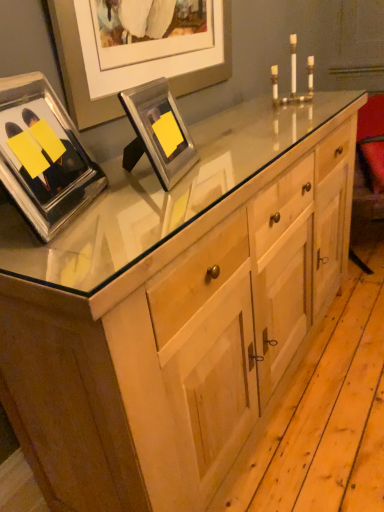
You are a GUI agent. You are given a task and a screenshot of the screen. Output one action in this format:
    pyautogui.click(x=<x>, y=<y>)
    Task: Click on the metallic silver picture frame at upper center, arranged as the 1th picture frame when viewed from the right
    The width and height of the screenshot is (384, 512).
    Given the screenshot: What is the action you would take?
    [158, 132]

Image resolution: width=384 pixels, height=512 pixels. Describe the element at coordinates (292, 79) in the screenshot. I see `gold metallic candle holder at upper center` at that location.

Image resolution: width=384 pixels, height=512 pixels. In order to click on clear glass picture frame at upper left, which is the 1th picture frame from left to right in this screenshot , I will do `click(43, 155)`.

You are a GUI agent. You are given a task and a screenshot of the screen. Output one action in this format:
    pyautogui.click(x=<x>, y=<y>)
    Task: Click on the metallic silver picture frame at upper center, arranged as the 1th picture frame when viewed from the right
    The height and width of the screenshot is (512, 384).
    Given the screenshot: What is the action you would take?
    pyautogui.click(x=158, y=132)

Can you confirm if clear glass picture frame at upper left, which is the second picture frame in right-to-left order, is shorter than gold metallic candle holder at upper center?

No.

From the picture: Which point is more distant from viewer, (17,157) or (281,104)?

The point (281,104) is farther from the camera.

Does clear glass picture frame at upper left, which is the second picture frame in right-to-left order, have a larger size compared to gold metallic candle holder at upper center?

Indeed, clear glass picture frame at upper left, which is the second picture frame in right-to-left order, has a larger size compared to gold metallic candle holder at upper center.

Is clear glass picture frame at upper left, which is the 1th picture frame from left to right, oriented towards metallic silver picture frame at upper center, arranged as the 1th picture frame when viewed from the right?

Yes.

How many degrees apart are the facing directions of clear glass picture frame at upper left, which is the second picture frame in right-to-left order, and metallic silver picture frame at upper center, arranged as the 1th picture frame when viewed from the right?

The angular difference between clear glass picture frame at upper left, which is the second picture frame in right-to-left order, and metallic silver picture frame at upper center, arranged as the 1th picture frame when viewed from the right, is 9.28 degrees.

Is point (38, 184) closer or farther from the camera than point (148, 110)?

Point (38, 184) appears to be closer to the viewer than point (148, 110).

Do you think clear glass picture frame at upper left, which is the second picture frame in right-to-left order, is within metallic silver picture frame at upper center, arranged as the second picture frame when viewed from the left, or outside of it?

clear glass picture frame at upper left, which is the second picture frame in right-to-left order, is spatially situated outside metallic silver picture frame at upper center, arranged as the second picture frame when viewed from the left.

Which object is thinner, gold metallic candle holder at upper center or clear glass picture frame at upper left, which is the 1th picture frame from left to right?

Thinner between the two is clear glass picture frame at upper left, which is the 1th picture frame from left to right.

From the image's perspective, is gold metallic candle holder at upper center below clear glass picture frame at upper left, which is the 1th picture frame from left to right?

No, from the image's perspective, gold metallic candle holder at upper center is not beneath clear glass picture frame at upper left, which is the 1th picture frame from left to right.

Is gold metallic candle holder at upper center taller or shorter than clear glass picture frame at upper left, which is the second picture frame in right-to-left order?

Clearly, gold metallic candle holder at upper center is shorter compared to clear glass picture frame at upper left, which is the second picture frame in right-to-left order.

Which object is more forward, gold metallic candle holder at upper center or clear glass picture frame at upper left, which is the 1th picture frame from left to right?

clear glass picture frame at upper left, which is the 1th picture frame from left to right.

Considering the sizes of objects metallic silver picture frame at upper center, arranged as the second picture frame when viewed from the left, and gold metallic candle holder at upper center in the image provided, who is shorter, metallic silver picture frame at upper center, arranged as the second picture frame when viewed from the left, or gold metallic candle holder at upper center?

metallic silver picture frame at upper center, arranged as the second picture frame when viewed from the left, is shorter.

Is point (148, 149) closer or farther from the camera than point (296, 74)?

Point (148, 149) is positioned closer to the camera compared to point (296, 74).

Does metallic silver picture frame at upper center, arranged as the 1th picture frame when viewed from the right, turn towards gold metallic candle holder at upper center?

No, metallic silver picture frame at upper center, arranged as the 1th picture frame when viewed from the right, is not turned towards gold metallic candle holder at upper center.

Measure the distance from metallic silver picture frame at upper center, arranged as the second picture frame when viewed from the left, to gold metallic candle holder at upper center.

metallic silver picture frame at upper center, arranged as the second picture frame when viewed from the left, and gold metallic candle holder at upper center are 35.37 inches apart from each other.

Is metallic silver picture frame at upper center, arranged as the 1th picture frame when viewed from the right, not near clear glass picture frame at upper left, which is the second picture frame in right-to-left order?

They are positioned close to each other.

Which object is thinner, metallic silver picture frame at upper center, arranged as the second picture frame when viewed from the left, or clear glass picture frame at upper left, which is the 1th picture frame from left to right?

Thinner between the two is metallic silver picture frame at upper center, arranged as the second picture frame when viewed from the left.

Is metallic silver picture frame at upper center, arranged as the second picture frame when viewed from the left, to the left of clear glass picture frame at upper left, which is the 1th picture frame from left to right, from the viewer's perspective?

Incorrect, metallic silver picture frame at upper center, arranged as the second picture frame when viewed from the left, is not on the left side of clear glass picture frame at upper left, which is the 1th picture frame from left to right.

Consider the image. In terms of height, does metallic silver picture frame at upper center, arranged as the 1th picture frame when viewed from the right, look taller or shorter compared to clear glass picture frame at upper left, which is the second picture frame in right-to-left order?

metallic silver picture frame at upper center, arranged as the 1th picture frame when viewed from the right, is shorter than clear glass picture frame at upper left, which is the second picture frame in right-to-left order.

Does point (275, 79) come closer to viewer compared to point (157, 135)?

No.

Locate an element on the screen. The width and height of the screenshot is (384, 512). picture frame beneath the gold metallic candle holder at upper center (from a real-world perspective) is located at coordinates pos(158,132).

Based on the photo, is gold metallic candle holder at upper center at the left side of metallic silver picture frame at upper center, arranged as the second picture frame when viewed from the left?

In fact, gold metallic candle holder at upper center is to the right of metallic silver picture frame at upper center, arranged as the second picture frame when viewed from the left.

In order to click on the 2nd picture frame to the left of the gold metallic candle holder at upper center, counting from the anchor's position in this screenshot , I will do `click(43, 155)`.

Locate an element on the screen. The height and width of the screenshot is (512, 384). picture frame that appears behind the clear glass picture frame at upper left, which is the 1th picture frame from left to right is located at coordinates (158, 132).

Considering their positions, is gold metallic candle holder at upper center positioned closer to metallic silver picture frame at upper center, arranged as the second picture frame when viewed from the left, than clear glass picture frame at upper left, which is the 1th picture frame from left to right?

Among the two, clear glass picture frame at upper left, which is the 1th picture frame from left to right, is located nearer to metallic silver picture frame at upper center, arranged as the second picture frame when viewed from the left.

Which object lies nearer to the anchor point gold metallic candle holder at upper center, clear glass picture frame at upper left, which is the 1th picture frame from left to right, or metallic silver picture frame at upper center, arranged as the second picture frame when viewed from the left?

metallic silver picture frame at upper center, arranged as the second picture frame when viewed from the left, lies closer to gold metallic candle holder at upper center than the other object.

When comparing their distances from gold metallic candle holder at upper center, does metallic silver picture frame at upper center, arranged as the 1th picture frame when viewed from the right, or clear glass picture frame at upper left, which is the 1th picture frame from left to right, seem closer?

Among the two, metallic silver picture frame at upper center, arranged as the 1th picture frame when viewed from the right, is located nearer to gold metallic candle holder at upper center.

Based on their spatial positions, is metallic silver picture frame at upper center, arranged as the 1th picture frame when viewed from the right, or gold metallic candle holder at upper center closer to clear glass picture frame at upper left, which is the 1th picture frame from left to right?

metallic silver picture frame at upper center, arranged as the 1th picture frame when viewed from the right, lies closer to clear glass picture frame at upper left, which is the 1th picture frame from left to right, than the other object.

Which object lies further to the anchor point metallic silver picture frame at upper center, arranged as the 1th picture frame when viewed from the right, clear glass picture frame at upper left, which is the second picture frame in right-to-left order, or gold metallic candle holder at upper center?

The object further to metallic silver picture frame at upper center, arranged as the 1th picture frame when viewed from the right, is gold metallic candle holder at upper center.

Estimate the real-world distances between objects in this image. Which object is closer to clear glass picture frame at upper left, which is the 1th picture frame from left to right, gold metallic candle holder at upper center or metallic silver picture frame at upper center, arranged as the second picture frame when viewed from the left?

Based on the image, metallic silver picture frame at upper center, arranged as the second picture frame when viewed from the left, appears to be nearer to clear glass picture frame at upper left, which is the 1th picture frame from left to right.

Identify the location of picture frame between clear glass picture frame at upper left, which is the 1th picture frame from left to right, and gold metallic candle holder at upper center, along the z-axis. (158, 132).